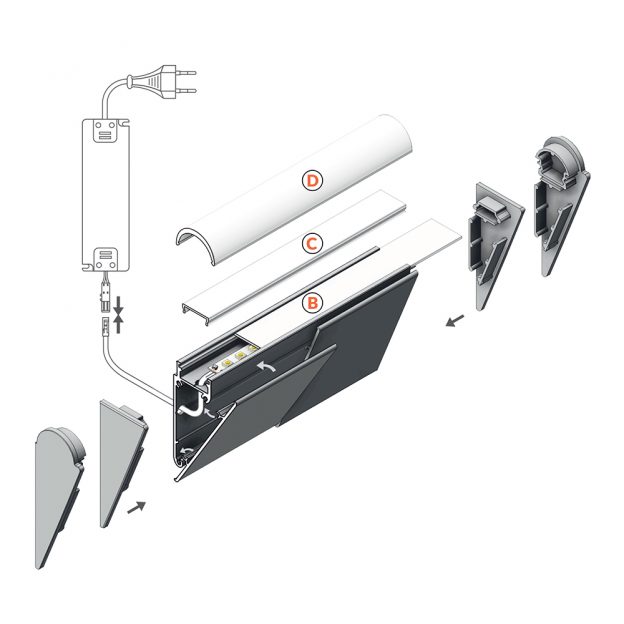
The width and height of the screenshot is (624, 624). In order to click on outlet connection in this screenshot , I will do [157, 85].